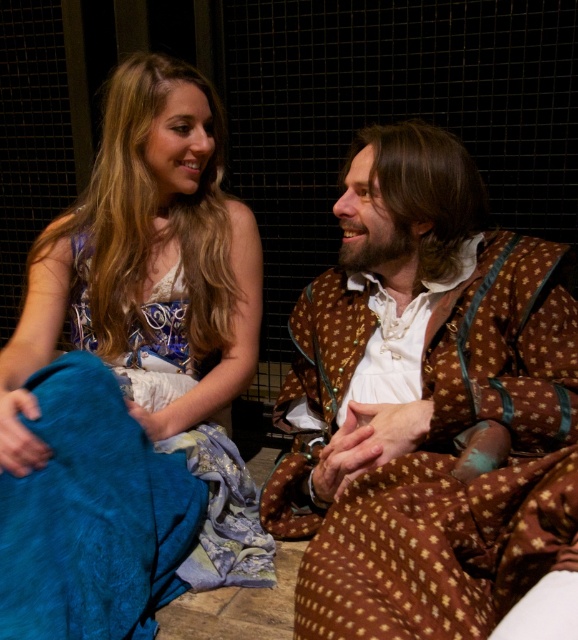
Question: Which point appears closest to the camera in this image?

Choices:
 (A) (209, 429)
 (B) (372, 164)
 (C) (108, 198)

Answer: (B)

Question: Among these objects, which one is farthest from the camera?

Choices:
 (A) silky blue fabric at lower left
 (B) matte blue fabric at left
 (C) brown textured fabric at right

Answer: (A)

Question: Is brown textured fabric at right further to the viewer compared to matte blue fabric at left?

Choices:
 (A) yes
 (B) no

Answer: (B)

Question: Which of the following is the closest to the observer?

Choices:
 (A) (187, 342)
 (B) (384, 632)

Answer: (B)

Question: Where is brown textured fabric at right located in relation to matte blue fabric at left in the image?

Choices:
 (A) below
 (B) above

Answer: (A)

Question: Can you confirm if brown textured fabric at right is wider than silky blue fabric at lower left?

Choices:
 (A) no
 (B) yes

Answer: (B)